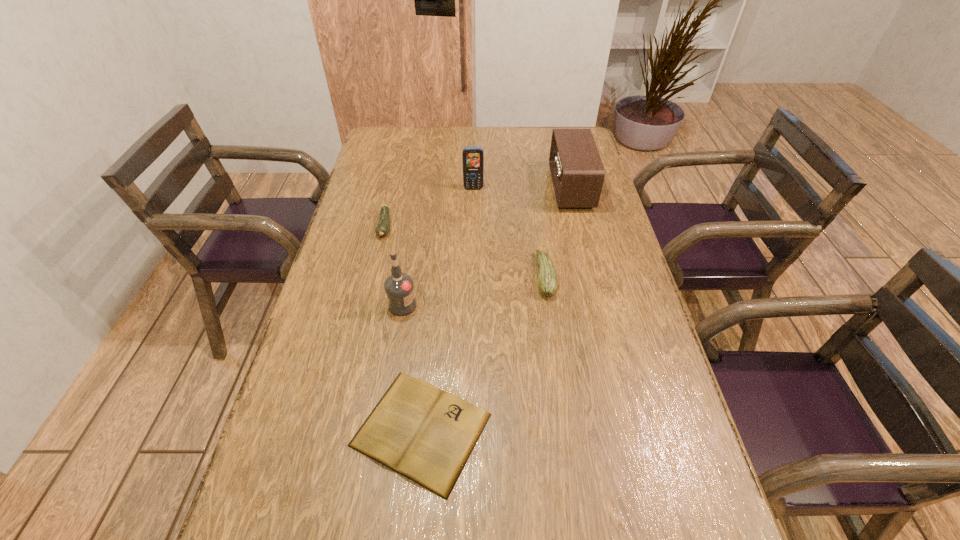
At what (x,y) coordinates should I click in order to perform the action: click on book situated at the left edge. Please return your answer as a coordinate pair (x, y). The image size is (960, 540). Looking at the image, I should click on (425, 434).

The height and width of the screenshot is (540, 960). I want to click on object that is at the right edge, so click(577, 172).

This screenshot has width=960, height=540. I want to click on vacant space at the left edge, so click(282, 456).

Identify the location of vacant space at the right edge of the desktop. (704, 524).

Find the location of a particular element. The height and width of the screenshot is (540, 960). free space between the second shortest object and the taller zucchini is located at coordinates (465, 251).

Where is `free area in between the shortest object and the fourth tallest object`? free area in between the shortest object and the fourth tallest object is located at coordinates tap(483, 353).

This screenshot has height=540, width=960. Identify the location of vacant area that lies between the cellular telephone and the farther zucchini. (429, 207).

This screenshot has height=540, width=960. I want to click on vacant area that lies between the tallest object and the cellular telephone, so click(438, 247).

Where is `vacant area between the radio receiver and the leftmost object`? This screenshot has height=540, width=960. vacant area between the radio receiver and the leftmost object is located at coordinates (478, 207).

Locate an element on the screen. The height and width of the screenshot is (540, 960). unoccupied area between the vodka and the cellular telephone is located at coordinates (438, 247).